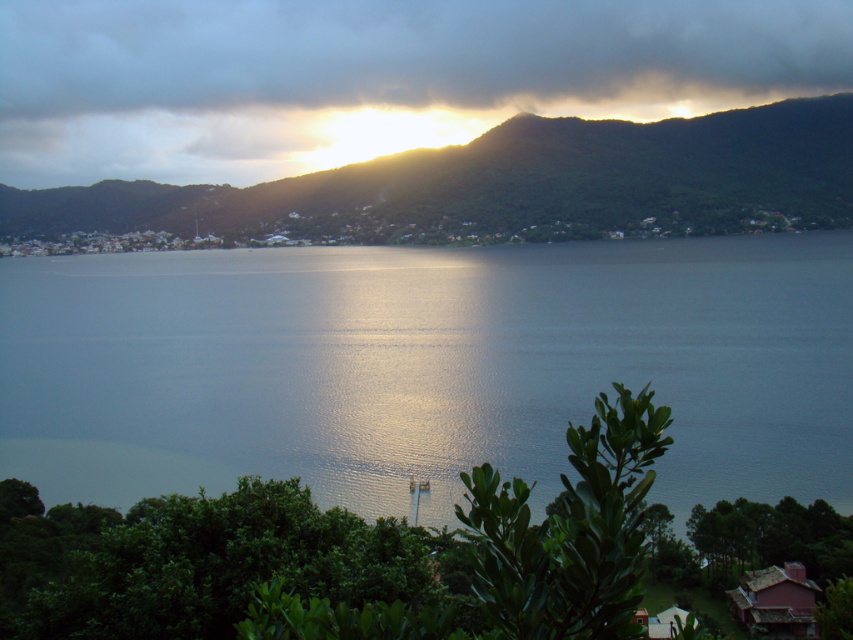
Does cloudy at upper center appear on the right side of green matte mountain at upper center?

Incorrect, cloudy at upper center is not on the right side of green matte mountain at upper center.

Which of these two, cloudy at upper center or green matte mountain at upper center, stands shorter?

With less height is green matte mountain at upper center.

In order to click on cloudy at upper center in this screenshot , I will do `click(372, 76)`.

Can you confirm if glistening water at center is taller than cloudy at upper center?

Incorrect, glistening water at center's height is not larger of cloudy at upper center's.

Between glistening water at center and cloudy at upper center, which one is positioned lower?

glistening water at center is lower down.

Does point (1, 433) come in front of point (610, 84)?

Yes, point (1, 433) is closer to viewer.

At what (x,y) coordinates should I click in order to perform the action: click on glistening water at center. Please return your answer as a coordinate pair (x, y). The width and height of the screenshot is (853, 640). Looking at the image, I should click on (426, 368).

Who is more distant from viewer, (509, 422) or (824, 211)?

Positioned behind is point (824, 211).

Can you confirm if glistening water at center is bigger than green matte mountain at upper center?

Actually, glistening water at center might be smaller than green matte mountain at upper center.

Does point (7, 348) come in front of point (502, 236)?

Yes.

Where is `glistening water at center`? Image resolution: width=853 pixels, height=640 pixels. glistening water at center is located at coordinates (426, 368).